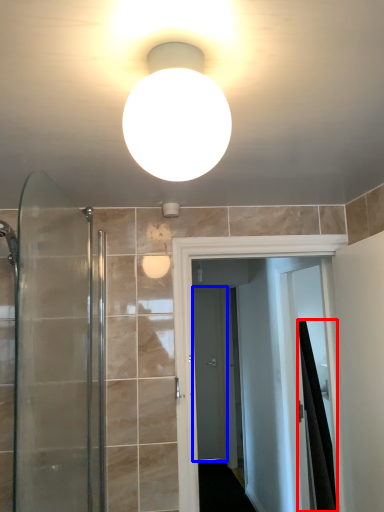
Question: Among these objects, which one is nearest to the camera, shower curtain (highlighted by a red box) or screen door (highlighted by a blue box)?

Choices:
 (A) shower curtain
 (B) screen door

Answer: (A)